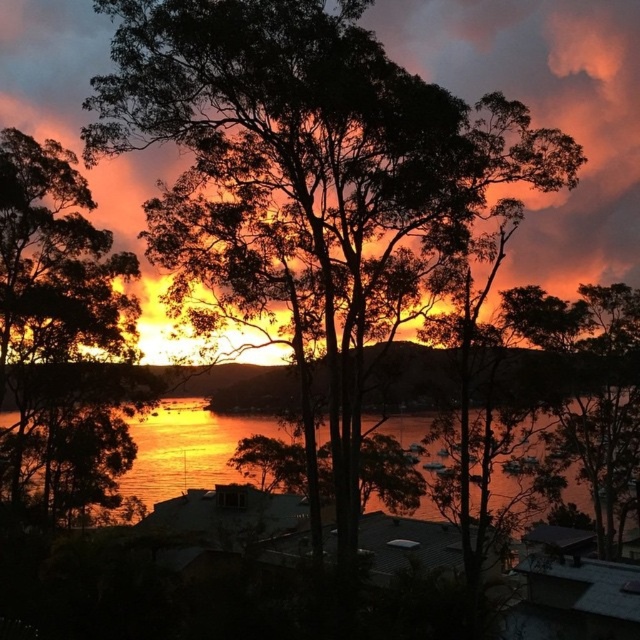
Question: Among these points, which one is farthest from the camera?

Choices:
 (A) (582, 90)
 (B) (394, 435)

Answer: (A)

Question: Which of these objects is positioned closest to the orange matte cloud at upper center?

Choices:
 (A) glistening water at center
 (B) silhouette leafy tree at left

Answer: (B)

Question: Which point is closer to the camera?

Choices:
 (A) silhouette leafy tree at left
 (B) glistening water at center

Answer: (B)

Question: Can you confirm if silhouette leafy tree at left is thinner than glistening water at center?

Choices:
 (A) yes
 (B) no

Answer: (A)

Question: Does silhouette leafy tree at left have a smaller size compared to glistening water at center?

Choices:
 (A) yes
 (B) no

Answer: (A)

Question: Is silhouette leafy tree at left positioned in front of glistening water at center?

Choices:
 (A) yes
 (B) no

Answer: (B)